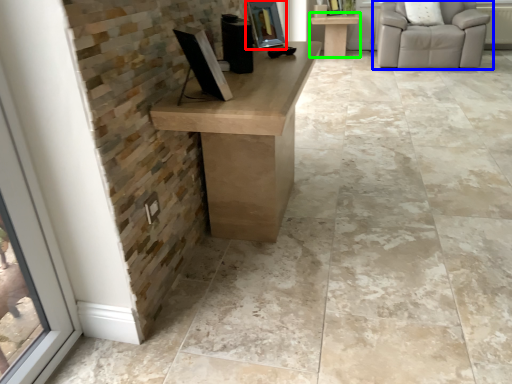
Question: Which object is the farthest from picture frame (highlighted by a red box)? Choose among these: chair (highlighted by a blue box) or table (highlighted by a green box).

Choices:
 (A) chair
 (B) table

Answer: (B)